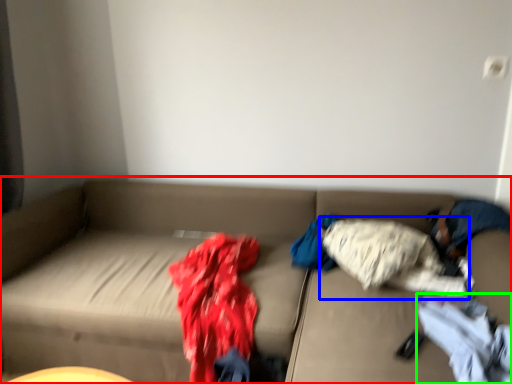
Question: Considering the real-world distances, which object is closest to studio couch (highlighted by a red box)? clothing (highlighted by a blue box) or clothing (highlighted by a green box).

Choices:
 (A) clothing
 (B) clothing

Answer: (A)